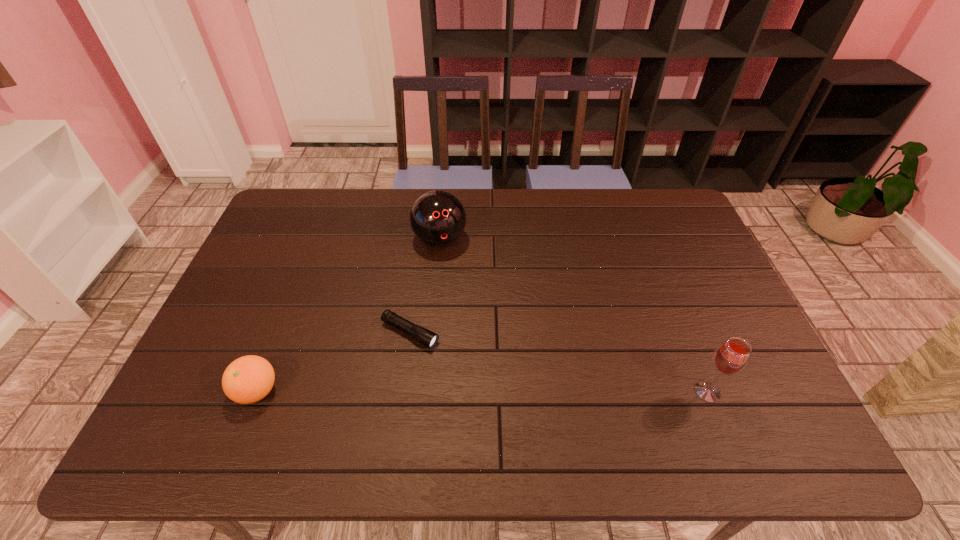
You are a GUI agent. You are given a task and a screenshot of the screen. Output one action in this format:
    pyautogui.click(x=<x>, y=<y>)
    Task: Click on the vacant space situated 0.400m on the surface of the farthest object near the finger holes
    The height and width of the screenshot is (540, 960).
    Given the screenshot: What is the action you would take?
    pyautogui.click(x=480, y=361)

At what (x,y) coordinates should I click in order to perform the action: click on vacant space located at the lens end of the second farthest object. Please return your answer as a coordinate pair (x, y). Looking at the image, I should click on (506, 382).

This screenshot has width=960, height=540. In order to click on vacant position located at the lens end of the second farthest object in this screenshot , I will do `click(531, 396)`.

Identify the location of vacant region located 0.140m at the lens end of the second farthest object. Image resolution: width=960 pixels, height=540 pixels. (479, 367).

This screenshot has height=540, width=960. Identify the location of object that is positioned at the far edge. pyautogui.click(x=437, y=218).

This screenshot has height=540, width=960. In order to click on orange at the near edge in this screenshot , I will do `click(248, 379)`.

I want to click on wineglass that is at the near edge, so click(x=731, y=357).

Find the location of a particular element. object located at the left edge is located at coordinates (248, 379).

Identify the location of object positioned at the right edge. (731, 357).

The image size is (960, 540). I want to click on object that is at the near left corner, so click(x=248, y=379).